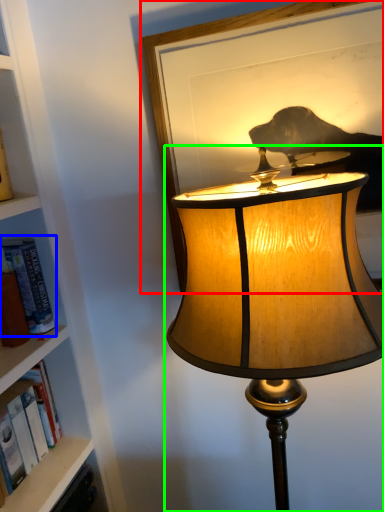
Question: Based on their relative distances, which object is nearer to picture frame (highlighted by a red box)? Choose from book (highlighted by a blue box) and lamp (highlighted by a green box).

Choices:
 (A) book
 (B) lamp

Answer: (B)